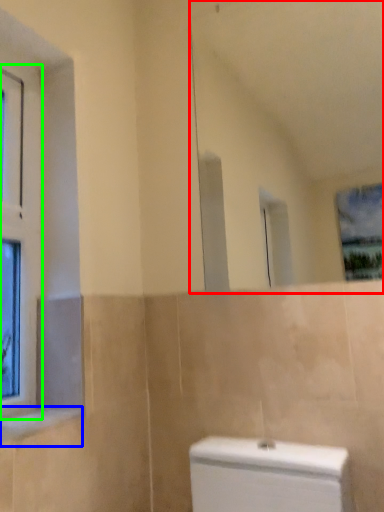
Question: Estimate the real-world distances between objects in this image. Which object is closer to mirror (highlighted by a red box), window sill (highlighted by a blue box) or window (highlighted by a green box)?

Choices:
 (A) window sill
 (B) window

Answer: (B)